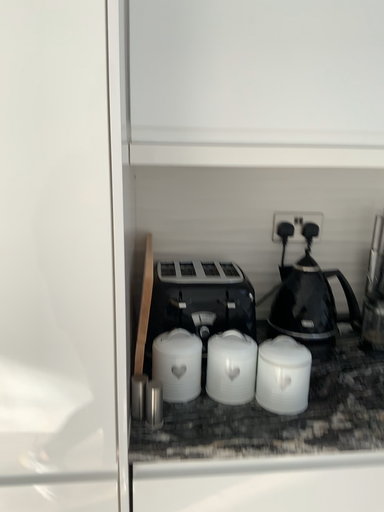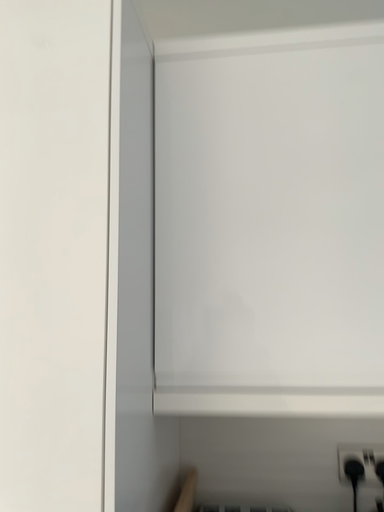
Question: Which way did the camera rotate in the video?

Choices:
 (A) rotated right
 (B) rotated left

Answer: (B)